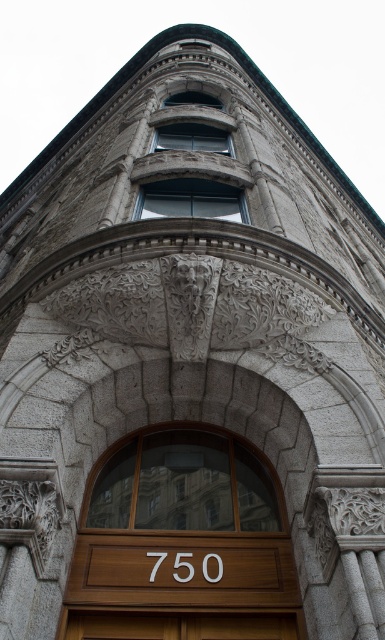
Can you confirm if wooden door at center is shorter than brown wooden door at center?

No.

Does wooden door at center come in front of brown wooden door at center?

Yes, wooden door at center is in front of brown wooden door at center.

Does point (217, 461) lie in front of point (147, 628)?

No, it is behind (147, 628).

Where is `wooden door at center`? The height and width of the screenshot is (640, 385). wooden door at center is located at coordinates (182, 544).